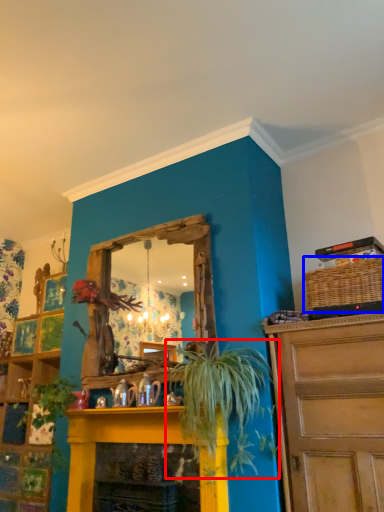
Question: Which object appears farthest to the camera in this image, houseplant (highlighted by a red box) or basket (highlighted by a blue box)?

Choices:
 (A) houseplant
 (B) basket

Answer: (B)